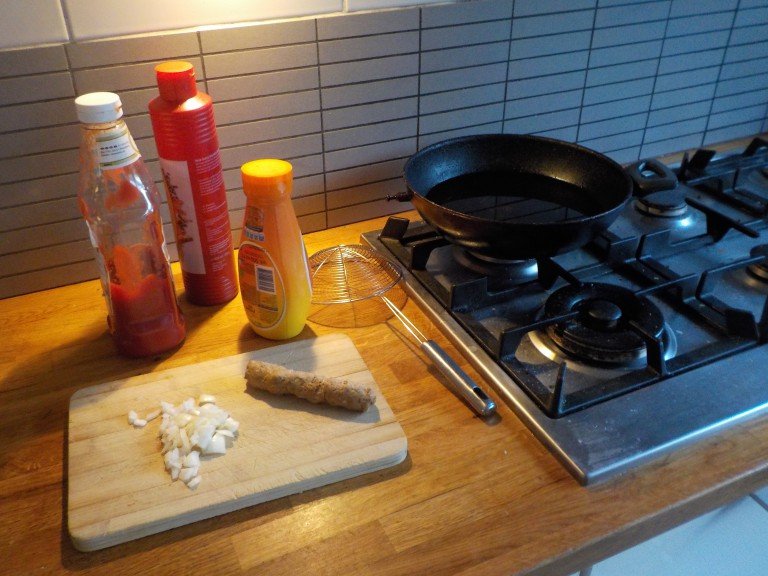
The image size is (768, 576). What are the coordinates of `stove` in the screenshot? It's located at [647, 319].